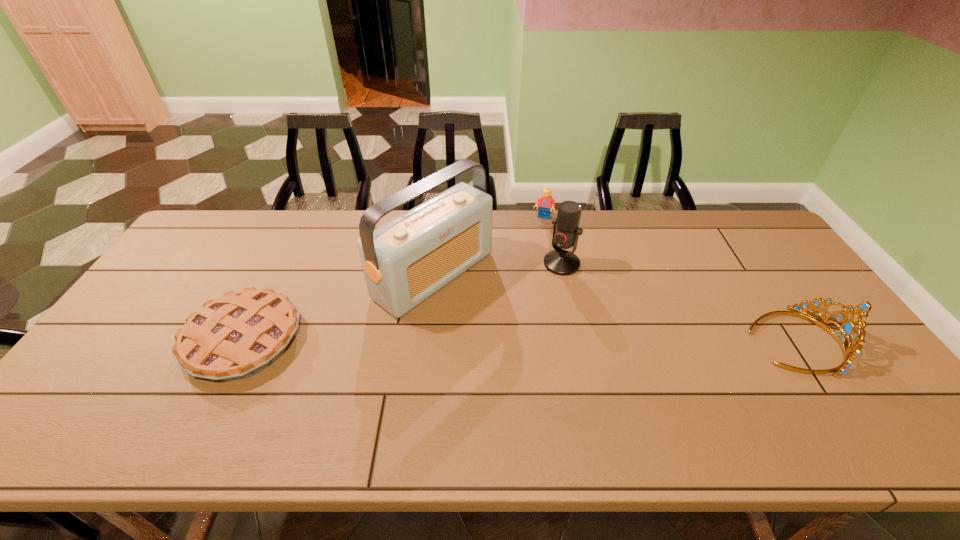
Image resolution: width=960 pixels, height=540 pixels. What are the coordinates of `pie` in the screenshot? It's located at (236, 336).

Find the location of a particular element. The width and height of the screenshot is (960, 540). the leftmost object is located at coordinates (236, 336).

I want to click on the third tallest object, so click(847, 328).

At what (x,y) coordinates should I click in order to perform the action: click on tiara. Please return your answer as a coordinate pair (x, y). Looking at the image, I should click on (847, 328).

This screenshot has width=960, height=540. Find the location of `microphone`. microphone is located at coordinates (566, 232).

Where is `Lego`? Lego is located at coordinates (546, 203).

Where is `the fourth tallest object`? The height and width of the screenshot is (540, 960). the fourth tallest object is located at coordinates tap(546, 203).

This screenshot has height=540, width=960. In order to click on the fourth object from right to left in this screenshot , I will do `click(405, 261)`.

You are a GUI agent. You are given a task and a screenshot of the screen. Output one action in this format:
    pyautogui.click(x=<x>, y=<y>)
    Task: Click on the tallest object
    This screenshot has width=960, height=540.
    Given the screenshot: What is the action you would take?
    pyautogui.click(x=405, y=261)

I want to click on vacant space situated 0.200m on the right of the leftmost object, so click(x=376, y=340).